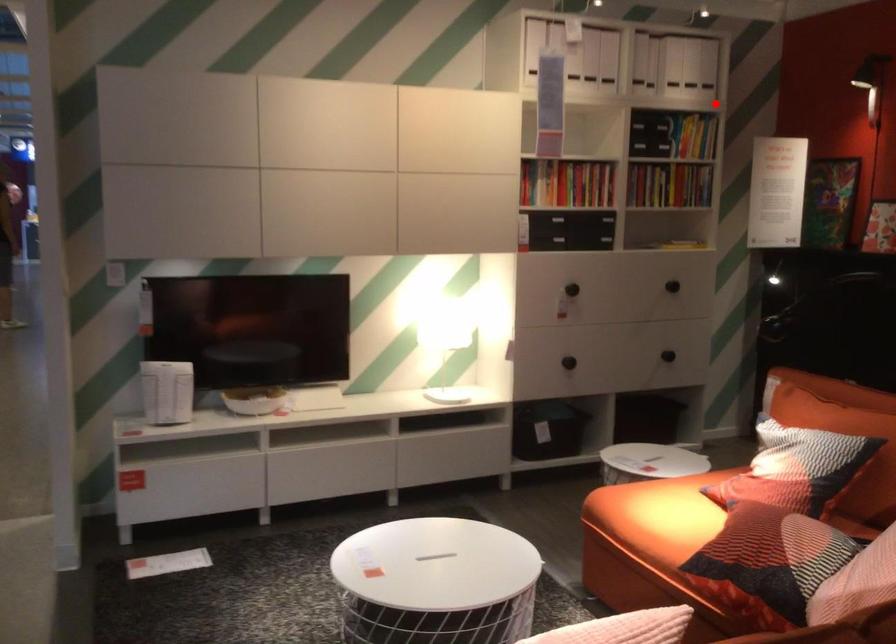
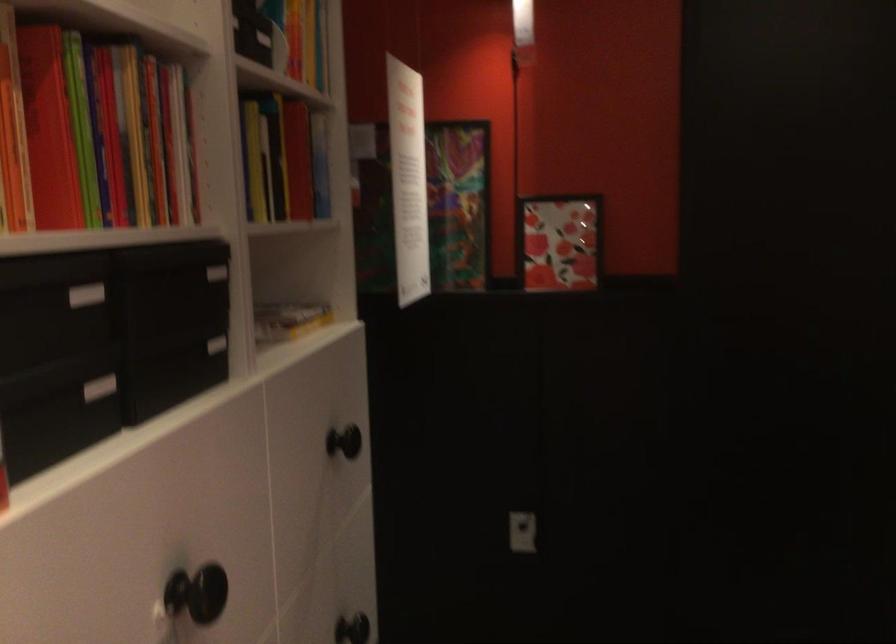
In the second image, find the point that corresponds to the highlighted location in the first image.

(309, 49)